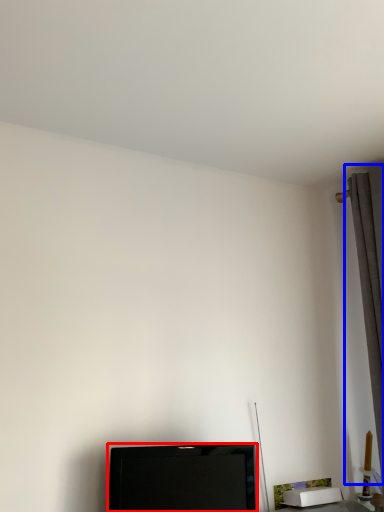
Question: Which of the following is the farthest to the observer, television (highlighted by a red box) or curtain (highlighted by a blue box)?

Choices:
 (A) television
 (B) curtain

Answer: (B)